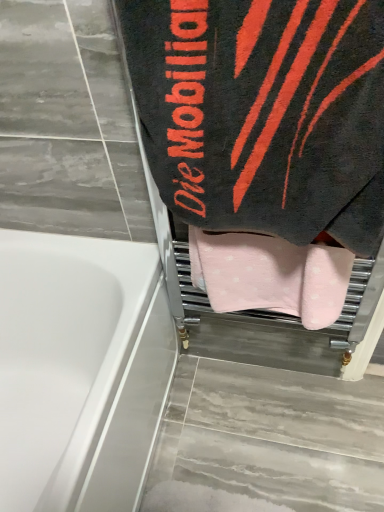
Question: Which direction should I rotate to face pink soft towel at center, which appears as the second towel when viewed from the top, — up or down?

Choices:
 (A) down
 (B) up

Answer: (A)

Question: Is black terry cloth towel at upper right, arranged as the second towel when ordered from the bottom, oriented towards white glossy bathtub at lower left?

Choices:
 (A) yes
 (B) no

Answer: (B)

Question: Considering the relative sizes of black terry cloth towel at upper right, arranged as the second towel when ordered from the bottom, and white glossy bathtub at lower left in the image provided, is black terry cloth towel at upper right, arranged as the second towel when ordered from the bottom, shorter than white glossy bathtub at lower left?

Choices:
 (A) no
 (B) yes

Answer: (B)

Question: From a real-world perspective, is black terry cloth towel at upper right, arranged as the second towel when ordered from the bottom, under white glossy bathtub at lower left?

Choices:
 (A) no
 (B) yes

Answer: (A)

Question: Does black terry cloth towel at upper right, positioned as the 1th towel in top-to-bottom order, have a larger size compared to white glossy bathtub at lower left?

Choices:
 (A) no
 (B) yes

Answer: (A)

Question: Can you confirm if black terry cloth towel at upper right, arranged as the second towel when ordered from the bottom, is smaller than white glossy bathtub at lower left?

Choices:
 (A) yes
 (B) no

Answer: (A)

Question: Would you consider black terry cloth towel at upper right, positioned as the 1th towel in top-to-bottom order, to be distant from white glossy bathtub at lower left?

Choices:
 (A) no
 (B) yes

Answer: (A)

Question: Does pink soft towel at center, which appears as the second towel when viewed from the top, have a greater width compared to black terry cloth towel at upper right, positioned as the 1th towel in top-to-bottom order?

Choices:
 (A) yes
 (B) no

Answer: (B)

Question: Considering the relative positions of pink soft towel at center, which appears as the second towel when viewed from the top, and black terry cloth towel at upper right, arranged as the second towel when ordered from the bottom, in the image provided, is pink soft towel at center, which appears as the second towel when viewed from the top, to the left of black terry cloth towel at upper right, arranged as the second towel when ordered from the bottom, from the viewer's perspective?

Choices:
 (A) yes
 (B) no

Answer: (B)

Question: Would you say black terry cloth towel at upper right, arranged as the second towel when ordered from the bottom, is part of pink soft towel at center, arranged as the first towel when ordered from the bottom,'s contents?

Choices:
 (A) no
 (B) yes

Answer: (A)

Question: Considering the relative positions of pink soft towel at center, arranged as the first towel when ordered from the bottom, and black terry cloth towel at upper right, positioned as the 1th towel in top-to-bottom order, in the image provided, is pink soft towel at center, arranged as the first towel when ordered from the bottom, in front of black terry cloth towel at upper right, positioned as the 1th towel in top-to-bottom order,?

Choices:
 (A) no
 (B) yes

Answer: (A)

Question: Would you say pink soft towel at center, arranged as the first towel when ordered from the bottom, is outside black terry cloth towel at upper right, positioned as the 1th towel in top-to-bottom order?

Choices:
 (A) no
 (B) yes

Answer: (B)

Question: Can you confirm if pink soft towel at center, which appears as the second towel when viewed from the top, is smaller than black terry cloth towel at upper right, arranged as the second towel when ordered from the bottom?

Choices:
 (A) yes
 (B) no

Answer: (A)

Question: Considering the relative positions of pink soft towel at center, which appears as the second towel when viewed from the top, and white glossy bathtub at lower left in the image provided, is pink soft towel at center, which appears as the second towel when viewed from the top, in front of white glossy bathtub at lower left?

Choices:
 (A) yes
 (B) no

Answer: (B)